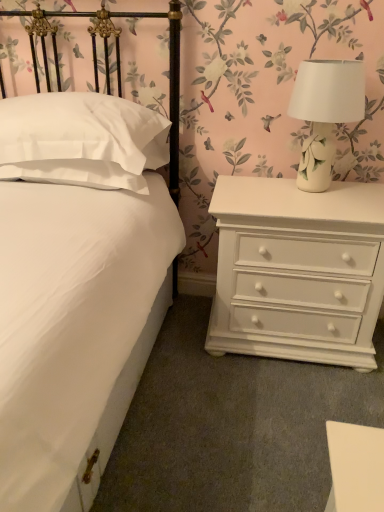
I want to click on white ceramic lamp at upper right, so click(x=325, y=113).

Where is `white painted wood chest of drawers at right`? white painted wood chest of drawers at right is located at coordinates (297, 271).

The image size is (384, 512). Find the location of `white matte bed at center`. white matte bed at center is located at coordinates (80, 278).

The height and width of the screenshot is (512, 384). In order to click on white satin pillow at left in this screenshot , I will do `click(82, 130)`.

Looking at this image, can you tell me how much white matte bed at center and white satin pillow at left differ in facing direction?

2.55 degrees.

Is white satin pillow at left surrounded by white matte bed at center?

Yes, white satin pillow at left is a part of white matte bed at center.

Is white matte bed at center positioned behind white satin pillow at left?

No, white matte bed at center is closer to the viewer.

From the image's perspective, which one is positioned lower, white matte bed at center or white satin pillow at left?

white matte bed at center, from the image's perspective.

Is white satin pillow at left positioned far away from white matte bed at center?

No, white satin pillow at left is not far away from white matte bed at center.

Considering the points (41, 147) and (45, 345), which point is behind, point (41, 147) or point (45, 345)?

The point (41, 147) is farther from the camera.

Measure the distance between white satin pillow at left and white matte bed at center.

A distance of 5.20 inches exists between white satin pillow at left and white matte bed at center.

In the image, there is a white satin pillow at left. Where is `bed below it (from the image's perspective)`? The height and width of the screenshot is (512, 384). bed below it (from the image's perspective) is located at coordinates (80, 278).

Is white ceramic lamp at upper right facing towards white painted wood chest of drawers at right?

No, white ceramic lamp at upper right is not oriented towards white painted wood chest of drawers at right.

Which is in front, white ceramic lamp at upper right or white painted wood chest of drawers at right?

white ceramic lamp at upper right is in front.

Considering the sizes of white ceramic lamp at upper right and white painted wood chest of drawers at right in the image, is white ceramic lamp at upper right taller or shorter than white painted wood chest of drawers at right?

Clearly, white ceramic lamp at upper right is shorter compared to white painted wood chest of drawers at right.

Is white painted wood chest of drawers at right positioned with its back to white matte bed at center?

No.

Is the position of white painted wood chest of drawers at right more distant than that of white matte bed at center?

Yes, white painted wood chest of drawers at right is behind white matte bed at center.

From a real-world perspective, who is located higher, white painted wood chest of drawers at right or white matte bed at center?

In real-world perspective, white matte bed at center is above.

Does white painted wood chest of drawers at right have a smaller size compared to white matte bed at center?

Yes.

From the image's perspective, between white satin pillow at left and white painted wood chest of drawers at right, who is located below?

white painted wood chest of drawers at right.

Is white satin pillow at left thinner than white painted wood chest of drawers at right?

In fact, white satin pillow at left might be wider than white painted wood chest of drawers at right.

Which is more to the left, white satin pillow at left or white painted wood chest of drawers at right?

white satin pillow at left is more to the left.

From the picture: Is white satin pillow at left smaller than white painted wood chest of drawers at right?

Yes.

From their relative heights in the image, would you say white ceramic lamp at upper right is taller or shorter than white satin pillow at left?

In the image, white ceramic lamp at upper right appears to be taller than white satin pillow at left.

Does white ceramic lamp at upper right have a greater width compared to white satin pillow at left?

No, white ceramic lamp at upper right is not wider than white satin pillow at left.

In the image, is white ceramic lamp at upper right on the left side or the right side of white satin pillow at left?

white ceramic lamp at upper right is positioned on white satin pillow at left's right side.

Is white ceramic lamp at upper right facing away from white satin pillow at left?

No.

In the scene shown: From a real-world perspective, which object rests below the other?

white painted wood chest of drawers at right is physically lower.

Are white matte bed at center and white painted wood chest of drawers at right beside each other?

There is a gap between white matte bed at center and white painted wood chest of drawers at right.

The height and width of the screenshot is (512, 384). In order to click on the chest of drawers lying behind the white matte bed at center in this screenshot , I will do 297,271.

From the picture: What's the angular difference between white matte bed at center and white painted wood chest of drawers at right's facing directions?

The angle between the facing direction of white matte bed at center and the facing direction of white painted wood chest of drawers at right is 2.21 degrees.

You are a GUI agent. You are given a task and a screenshot of the screen. Output one action in this format:
    pyautogui.click(x=<x>, y=<y>)
    Task: Click on the bed in front of the white satin pillow at left
    
    Given the screenshot: What is the action you would take?
    pyautogui.click(x=80, y=278)

The image size is (384, 512). Identify the location of bed that appears on the right of white satin pillow at left. (80, 278).

Estimate the real-world distances between objects in this image. Which object is closer to white ceramic lamp at upper right, white painted wood chest of drawers at right or white satin pillow at left?

Among the two, white painted wood chest of drawers at right is located nearer to white ceramic lamp at upper right.

From the picture: Considering their positions, is white ceramic lamp at upper right positioned further to white satin pillow at left than white matte bed at center?

Among the two, white ceramic lamp at upper right is located further to white satin pillow at left.

Based on their spatial positions, is white matte bed at center or white ceramic lamp at upper right further from white satin pillow at left?

The object further to white satin pillow at left is white ceramic lamp at upper right.

When comparing their distances from white matte bed at center, does white painted wood chest of drawers at right or white ceramic lamp at upper right seem closer?

white painted wood chest of drawers at right is positioned closer to the anchor white matte bed at center.

Looking at the image, which one is located further to white ceramic lamp at upper right, white matte bed at center or white painted wood chest of drawers at right?

white matte bed at center lies further to white ceramic lamp at upper right than the other object.

Considering their positions, is white ceramic lamp at upper right positioned further to white painted wood chest of drawers at right than white satin pillow at left?

white satin pillow at left lies further to white painted wood chest of drawers at right than the other object.

Looking at the image, which one is located closer to white painted wood chest of drawers at right, white matte bed at center or white ceramic lamp at upper right?

Among the two, white ceramic lamp at upper right is located nearer to white painted wood chest of drawers at right.

Which object lies further to the anchor point white ceramic lamp at upper right, white matte bed at center or white satin pillow at left?

white matte bed at center.

This screenshot has height=512, width=384. In order to click on table lamp between white matte bed at center and white painted wood chest of drawers at right in the front-back direction in this screenshot , I will do `click(325, 113)`.

Image resolution: width=384 pixels, height=512 pixels. I want to click on pillow between white matte bed at center and white painted wood chest of drawers at right in the front-back direction, so click(82, 130).

Locate an element on the screen. chest of drawers between white satin pillow at left and white ceramic lamp at upper right in the horizontal direction is located at coordinates (297, 271).

You are a GUI agent. You are given a task and a screenshot of the screen. Output one action in this format:
    pyautogui.click(x=<x>, y=<y>)
    Task: Click on the bed located between white satin pillow at left and white ceramic lamp at upper right in the left-right direction
    
    Given the screenshot: What is the action you would take?
    pyautogui.click(x=80, y=278)